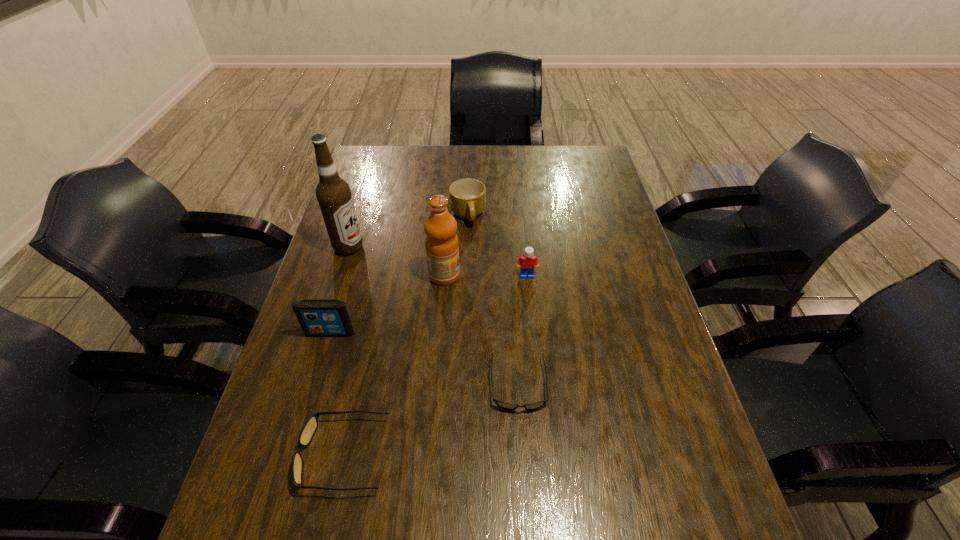
Find the location of `the third nearest object`. the third nearest object is located at coordinates (317, 317).

At what (x,y) coordinates should I click in order to perform the action: click on vacant space located on the front-facing side of the taller sunglasses. Please return your answer as a coordinate pair (x, y). Looking at the image, I should click on (266, 455).

Image resolution: width=960 pixels, height=540 pixels. In order to click on vacant space situated on the front-facing side of the right sunglasses in this screenshot , I will do `click(522, 441)`.

Find the location of `free region located on the label side of the fruit juice`. free region located on the label side of the fruit juice is located at coordinates 520,275.

The width and height of the screenshot is (960, 540). In order to click on free space located on the label of the tallest object in this screenshot , I will do `click(387, 247)`.

Where is `free region located 0.110m on the face of the Lego`? free region located 0.110m on the face of the Lego is located at coordinates (530, 309).

What are the coordinates of `vacant space located on the side with the handle of the third shortest object` in the screenshot? It's located at pyautogui.click(x=465, y=324).

What are the coordinates of `vacant space positioned 0.050m on the front screen of the iPod` in the screenshot? It's located at (324, 354).

In order to click on object situated at the near edge in this screenshot , I will do `click(309, 428)`.

At what (x,y) coordinates should I click in order to perform the action: click on sunglasses situated at the left edge. Please return your answer as a coordinate pair (x, y). Looking at the image, I should click on (309, 428).